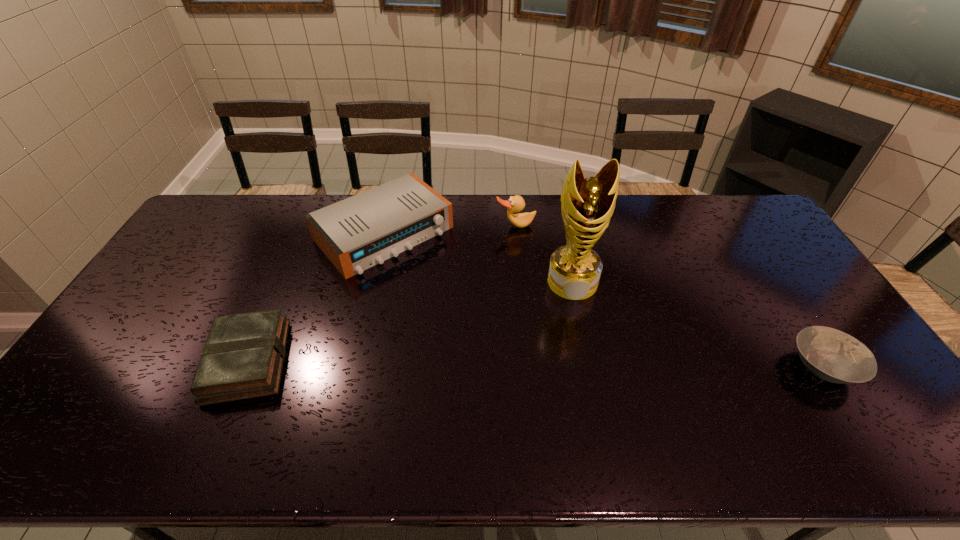
Choose which object is the nearest neighbor to the third tallest object. Please provide its 2D coordinates. Your answer should be formatted as a tuple, i.e. [(x, y)], where the tuple contains the x and y coordinates of a point satisfying the conditions above.

[(516, 203)]

Locate which object is the fourth closest to the fourth shortest object. Please provide its 2D coordinates. Your answer should be formatted as a tuple, i.e. [(x, y)], where the tuple contains the x and y coordinates of a point satisfying the conditions above.

[(832, 355)]

Locate an element on the screen. The width and height of the screenshot is (960, 540). vacant point that satisfies the following two spatial constraints: 1. on the front side of the book; 2. on the left side of the rightmost object is located at coordinates (245, 367).

At what (x,y) coordinates should I click in order to perform the action: click on vacant position in the image that satisfies the following two spatial constraints: 1. on the front side of the award; 2. on the left side of the radio receiver. Please return your answer as a coordinate pair (x, y). The width and height of the screenshot is (960, 540). Looking at the image, I should click on (372, 282).